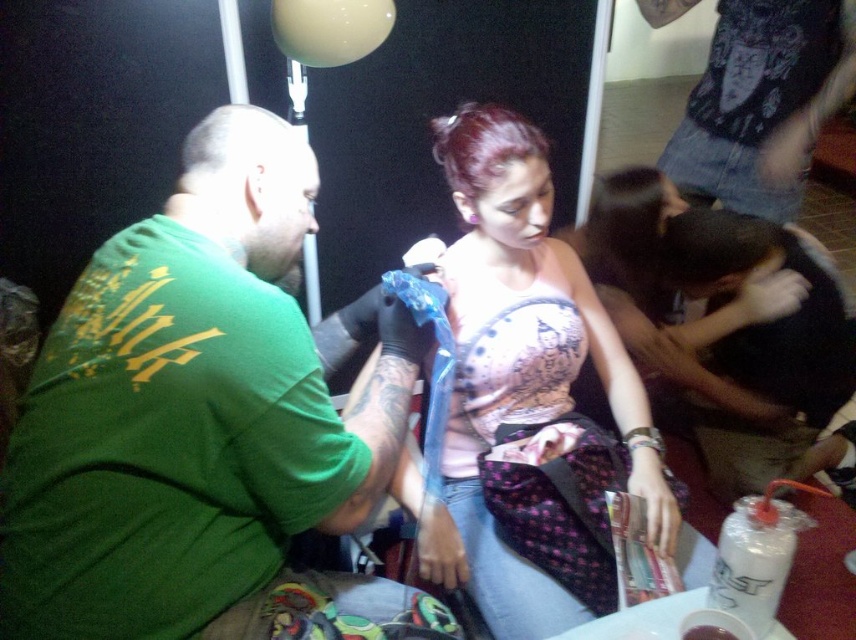
Question: Can you confirm if green matte shirt at left is positioned to the left of matte pink tank top at center?

Choices:
 (A) yes
 (B) no

Answer: (A)

Question: Which object appears closest to the camera in this image?

Choices:
 (A) denim jeans at upper right
 (B) matte pink tank top at center
 (C) green matte shirt at left

Answer: (C)

Question: Estimate the real-world distances between objects in this image. Which object is farther from the denim jeans at upper right?

Choices:
 (A) matte pink tank top at center
 (B) green matte shirt at left

Answer: (B)

Question: Can you confirm if green matte shirt at left is wider than matte pink tank top at center?

Choices:
 (A) yes
 (B) no

Answer: (A)

Question: Is green matte shirt at left positioned behind matte pink tank top at center?

Choices:
 (A) yes
 (B) no

Answer: (B)

Question: Among these objects, which one is farthest from the camera?

Choices:
 (A) green matte shirt at left
 (B) denim jeans at upper right

Answer: (B)